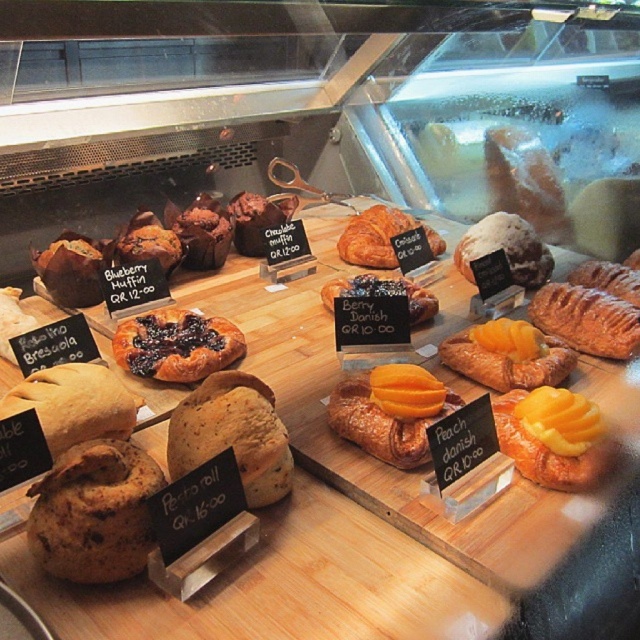
Question: Can you confirm if golden flaky croissant at center-right is wider than berry-colored danish at center?

Choices:
 (A) yes
 (B) no

Answer: (B)

Question: Can you confirm if brown crumbly pastry at center-left is thinner than golden flaky croissant at center-right?

Choices:
 (A) yes
 (B) no

Answer: (A)

Question: Estimate the real-world distances between objects in this image. Which object is farther from the brown crumbly roll at center?

Choices:
 (A) glazed sugar-coated bun at center
 (B) yellow matte peach at center
 (C) brown matte pesto roll at lower left
 (D) dark brown paper cupcake at center-left

Answer: (A)

Question: Is dark brown paper cupcake at center-left bigger than golden flaky croissant at center-right?

Choices:
 (A) yes
 (B) no

Answer: (A)

Question: Which point is closer to the camera?

Choices:
 (A) (161, 333)
 (B) (576, 268)
 (C) (390, 445)

Answer: (C)

Question: Which of the following is the farthest from the observer?

Choices:
 (A) (385, 392)
 (B) (330, 301)

Answer: (B)